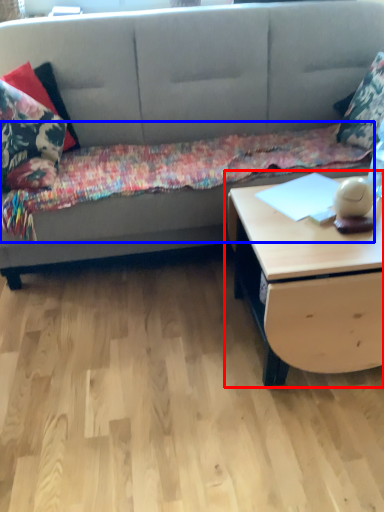
Question: Among these objects, which one is nearest to the camera, table (highlighted by a red box) or blanket (highlighted by a blue box)?

Choices:
 (A) table
 (B) blanket

Answer: (A)